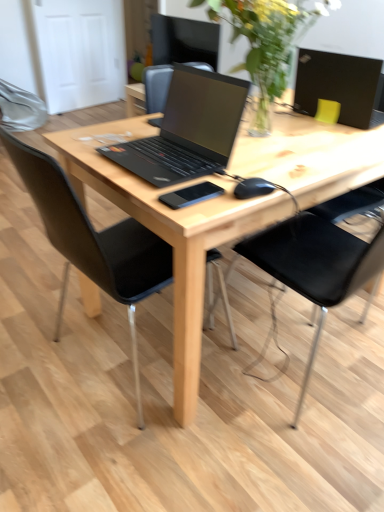
You are a GUI agent. You are given a task and a screenshot of the screen. Output one action in this format:
    pyautogui.click(x=<x>, y=<y>)
    Task: Click on the free space in front of translucent glass vase at center
    
    Given the screenshot: What is the action you would take?
    pyautogui.click(x=284, y=165)